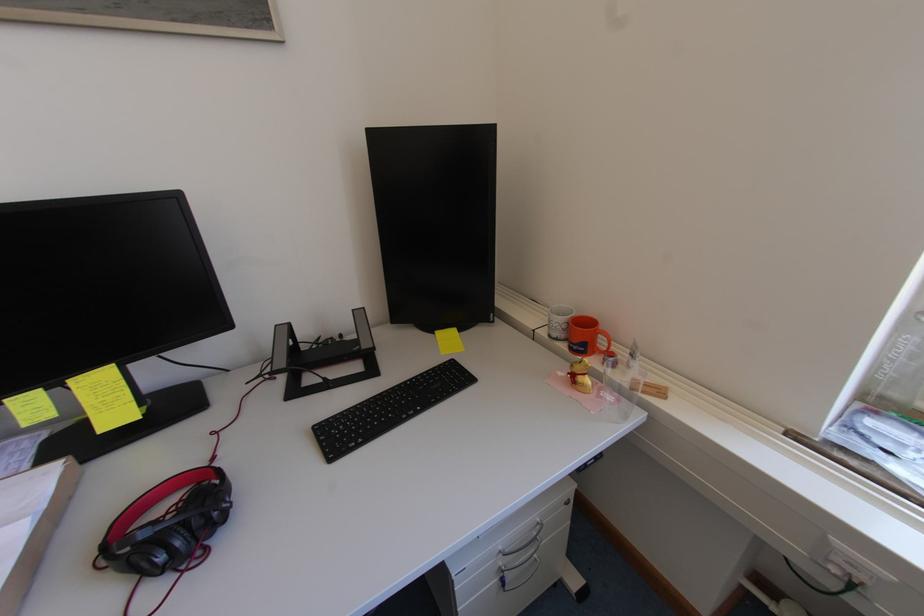
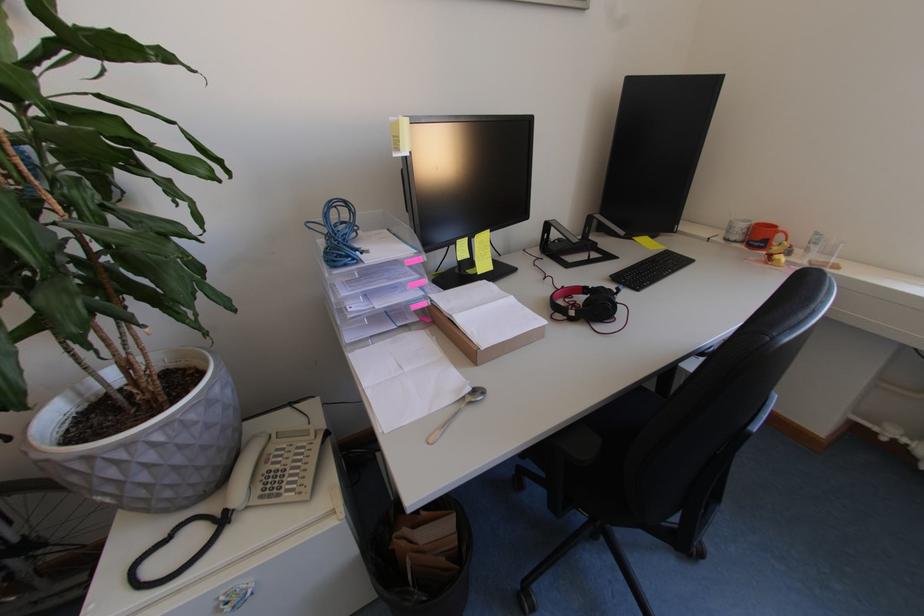
The images are taken continuously from a first-person perspective. In which direction are you moving?

The cameraman walked toward left, backward.